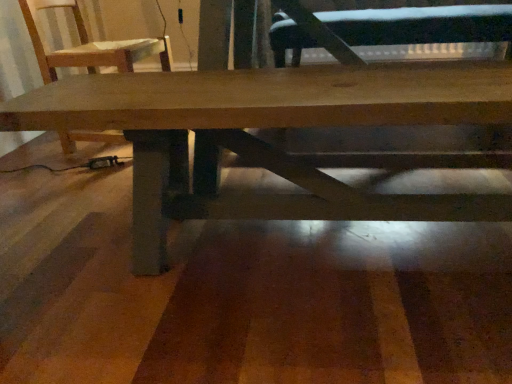
At what (x,y) coordinates should I click in order to perform the action: click on free point in front of wooden chair at upper left. Please return your answer as a coordinate pair (x, y). This screenshot has width=512, height=384. Looking at the image, I should click on (63, 185).